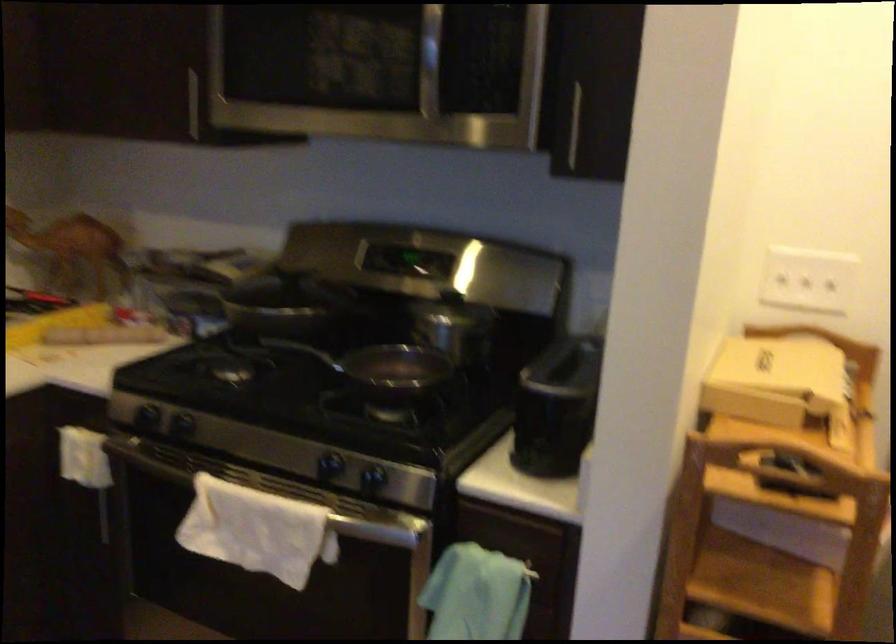
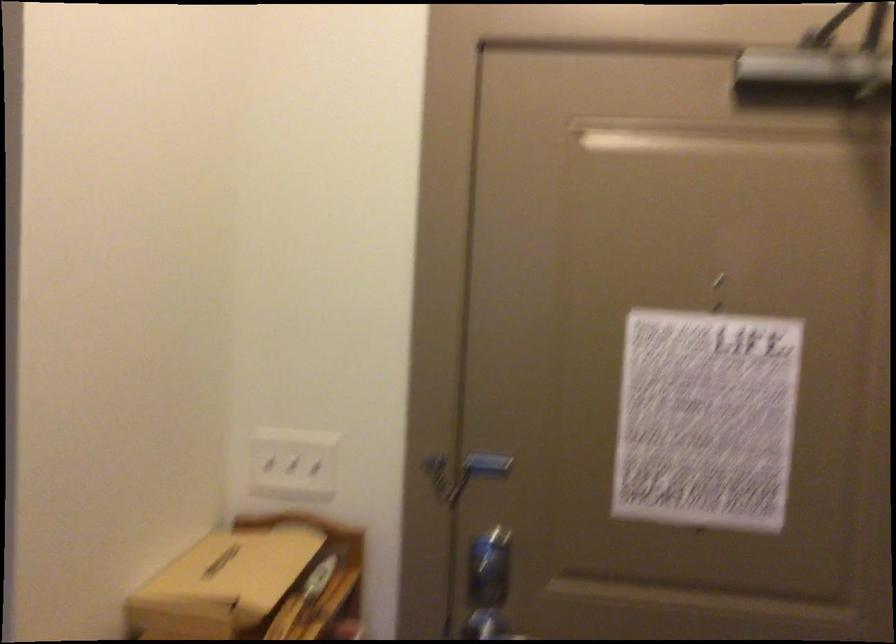
Question: How did the camera likely rotate?

Choices:
 (A) Left
 (B) Right
 (C) Up
 (D) Down

Answer: (B)